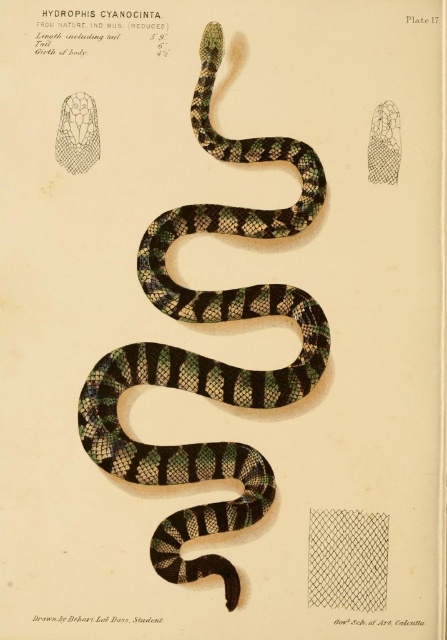
Question: Is green and black striped snake at center wider than netted fabric at center?

Choices:
 (A) no
 (B) yes

Answer: (B)

Question: Can you confirm if green and black striped snake at center is positioned below netted fabric at center?

Choices:
 (A) no
 (B) yes

Answer: (A)

Question: Is green and black striped snake at center closer to camera compared to netted fabric at center?

Choices:
 (A) yes
 (B) no

Answer: (A)